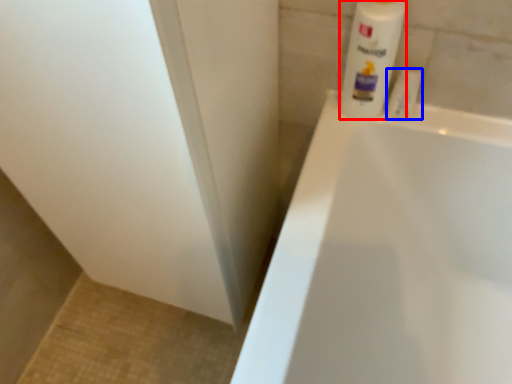
Question: Which point is further to the camera, cleaning product (highlighted by a red box) or toiletry (highlighted by a blue box)?

Choices:
 (A) cleaning product
 (B) toiletry

Answer: (B)